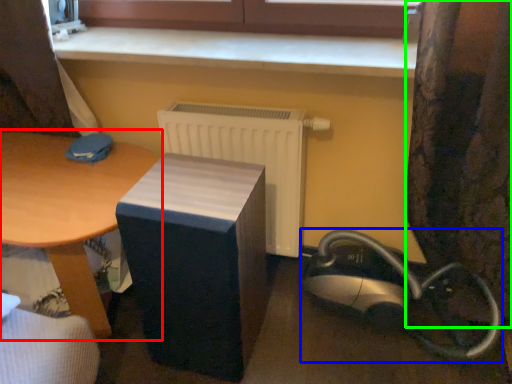
Question: Which object is positioned closest to table (highlighted by a red box)? Select from equipment (highlighted by a blue box) and curtain (highlighted by a green box).

Choices:
 (A) equipment
 (B) curtain

Answer: (A)